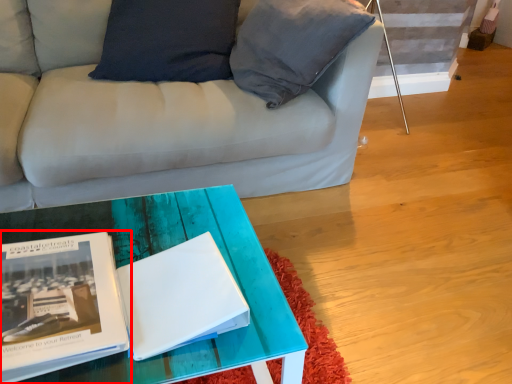
Question: From the image, what is the correct spatial relationship of book (annotated by the red box) in relation to magazine?

Choices:
 (A) left
 (B) right

Answer: (A)